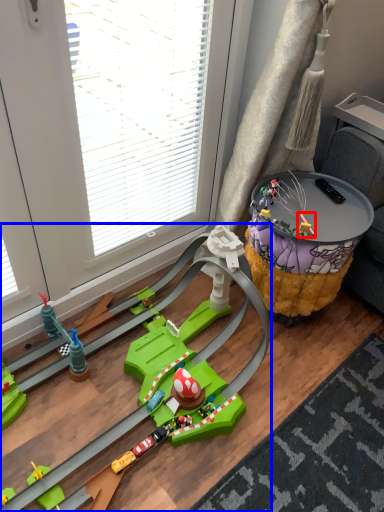
Question: Which object appears farthest to the camera in this image, toy (highlighted by a red box) or toy (highlighted by a blue box)?

Choices:
 (A) toy
 (B) toy

Answer: (A)